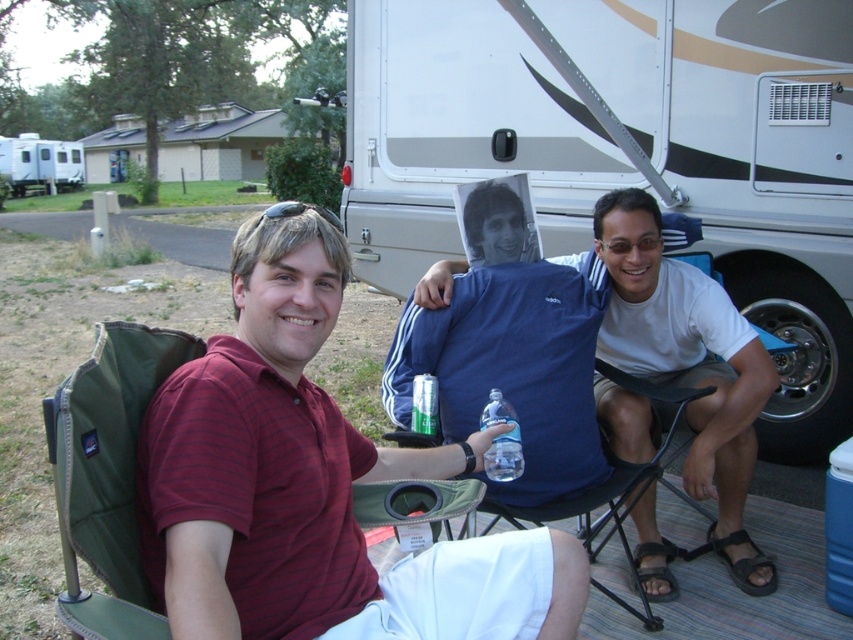
Is white glossy recreational vehicle at center taller than black leather sandal at lower right?

Yes, white glossy recreational vehicle at center is taller than black leather sandal at lower right.

Between white glossy recreational vehicle at center and black leather sandal at lower right, which one is positioned higher?

Positioned higher is white glossy recreational vehicle at center.

The width and height of the screenshot is (853, 640). Find the location of `white glossy recreational vehicle at center`. white glossy recreational vehicle at center is located at coordinates (747, 168).

Locate an element on the screen. white glossy recreational vehicle at center is located at coordinates (747, 168).

Does green fabric chair at lower left appear on the right side of brown leather sandal at lower right?

In fact, green fabric chair at lower left is to the left of brown leather sandal at lower right.

Between green fabric chair at lower left and brown leather sandal at lower right, which one is positioned lower?

brown leather sandal at lower right

You are a GUI agent. You are given a task and a screenshot of the screen. Output one action in this format:
    pyautogui.click(x=<x>, y=<y>)
    Task: Click on the green fabric chair at lower left
    The width and height of the screenshot is (853, 640).
    Given the screenshot: What is the action you would take?
    pyautogui.click(x=108, y=474)

Can you confirm if black leather sandal at lower right is positioned below green metallic can at center?

Correct, black leather sandal at lower right is located below green metallic can at center.

Is the position of black leather sandal at lower right more distant than that of green metallic can at center?

Yes, black leather sandal at lower right is behind green metallic can at center.

Between point (753, 589) and point (430, 428), which one is positioned in front?

Point (430, 428) is more forward.

Locate an element on the screen. This screenshot has width=853, height=640. black leather sandal at lower right is located at coordinates (741, 561).